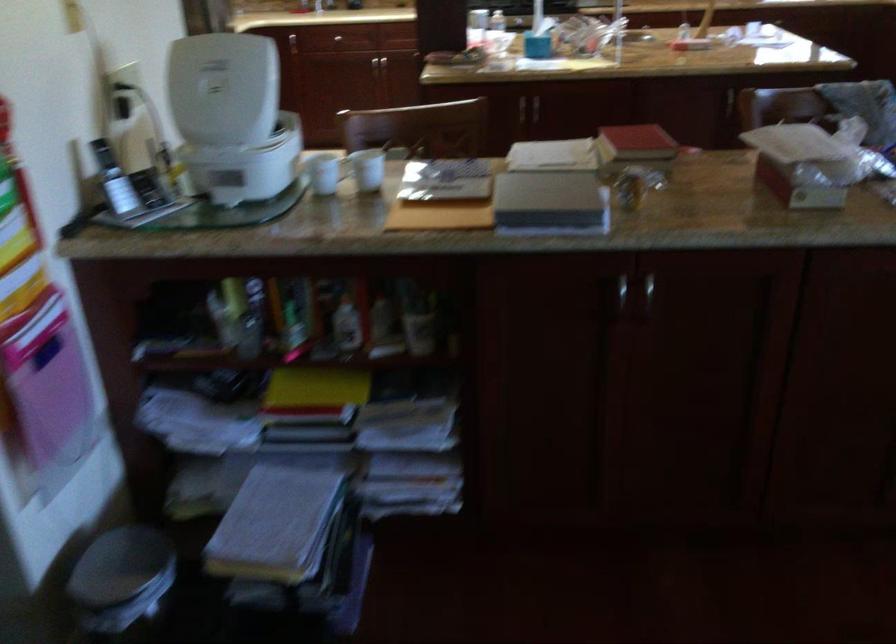
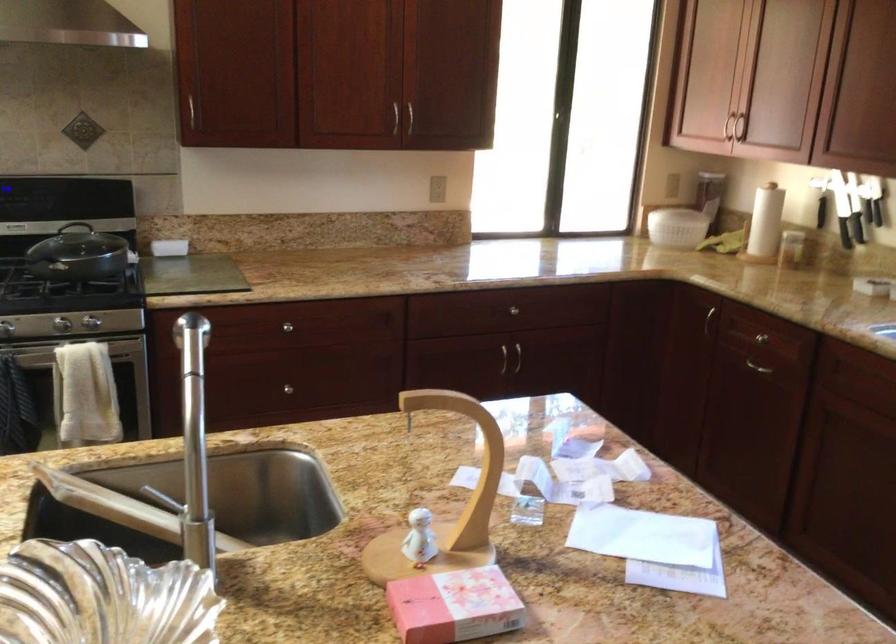
Question: What movement of the cameraman would produce the second image?

Choices:
 (A) Left
 (B) Right
 (C) Forward
 (D) Backward

Answer: (C)